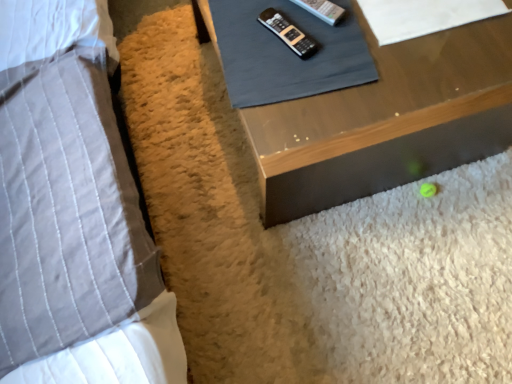
This screenshot has width=512, height=384. I want to click on vacant space positioned to the left of black plastic remote at upper center, so click(x=241, y=36).